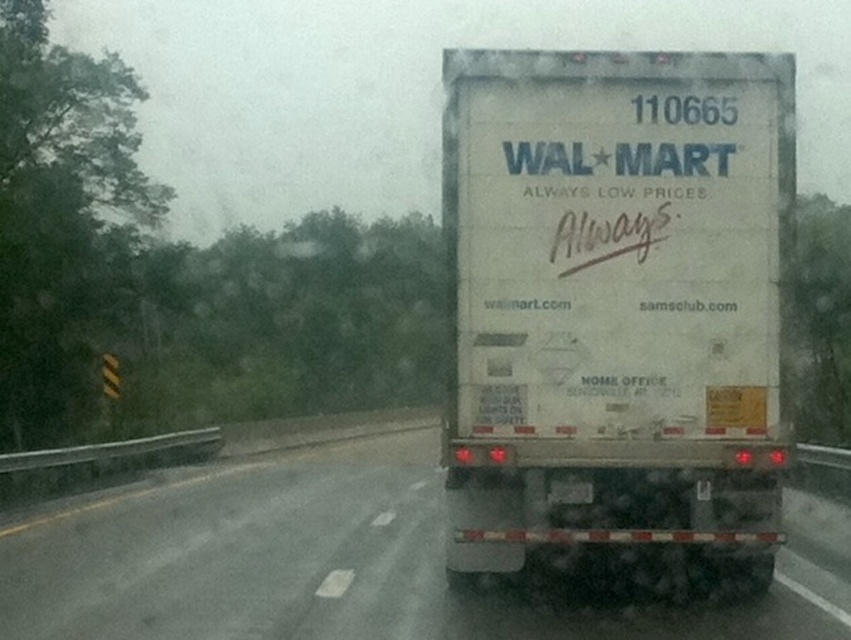
Question: Can you confirm if white matte trailer truck at center is bigger than white matte truck at center?

Choices:
 (A) no
 (B) yes

Answer: (A)

Question: Does white matte trailer truck at center appear under white matte truck at center?

Choices:
 (A) yes
 (B) no

Answer: (B)

Question: Does white matte trailer truck at center have a smaller size compared to white matte truck at center?

Choices:
 (A) yes
 (B) no

Answer: (A)

Question: Which point is closer to the camera taking this photo?

Choices:
 (A) (417, 486)
 (B) (503, 540)

Answer: (B)